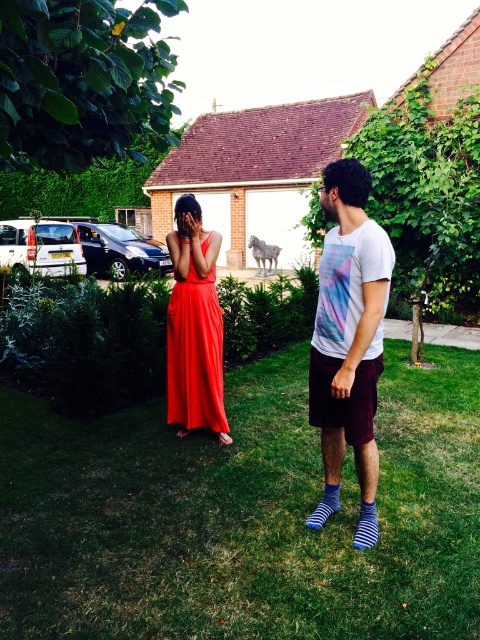
Question: Can you confirm if matte red dress at center is wider than white tie-dye t-shirt at center?

Choices:
 (A) yes
 (B) no

Answer: (A)

Question: Which object appears farthest from the camera in this image?

Choices:
 (A) green grass at center
 (B) matte red dress at center
 (C) shiny satin dress at center
 (D) white tie-dye t-shirt at center

Answer: (C)

Question: Which point is farther to the camera?

Choices:
 (A) (369, 232)
 (B) (340, 403)

Answer: (B)

Question: Which object is farther from the camera taking this photo?

Choices:
 (A) green grass at center
 (B) shiny satin dress at center

Answer: (B)

Question: Is matte red dress at center positioned in front of shiny satin dress at center?

Choices:
 (A) no
 (B) yes

Answer: (B)

Question: Can you confirm if matte red dress at center is positioned to the right of shiny satin dress at center?

Choices:
 (A) no
 (B) yes

Answer: (B)